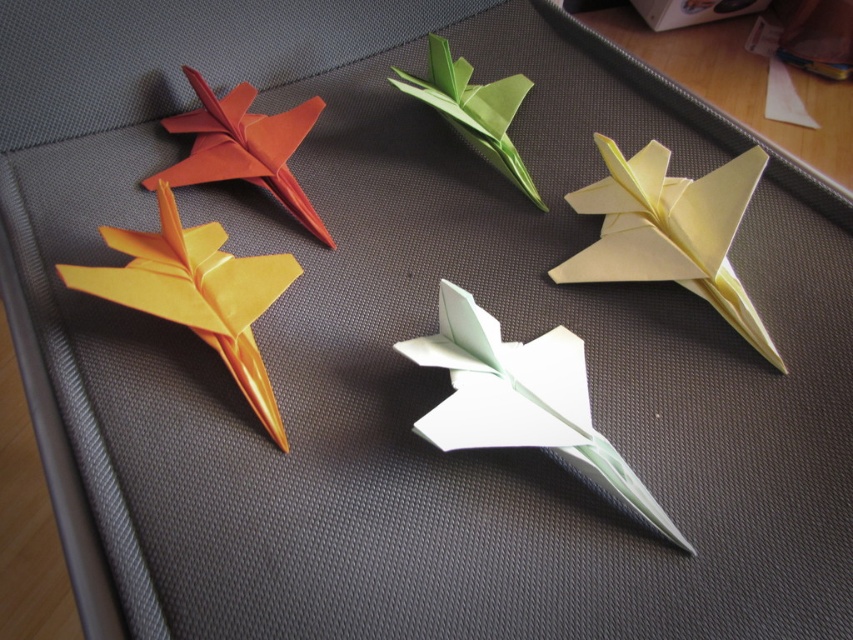
Question: Is matte yellow paper airplane at left further to camera compared to white paper at upper right?

Choices:
 (A) yes
 (B) no

Answer: (B)

Question: Which of the following is the closest to the observer?

Choices:
 (A) matte yellow paper airplane at left
 (B) white paper at upper right

Answer: (A)

Question: Is matte yellow paper airplane at left above white paper at upper right?

Choices:
 (A) yes
 (B) no

Answer: (B)

Question: Is matte yellow paper airplane at left wider than white paper at upper right?

Choices:
 (A) no
 (B) yes

Answer: (B)